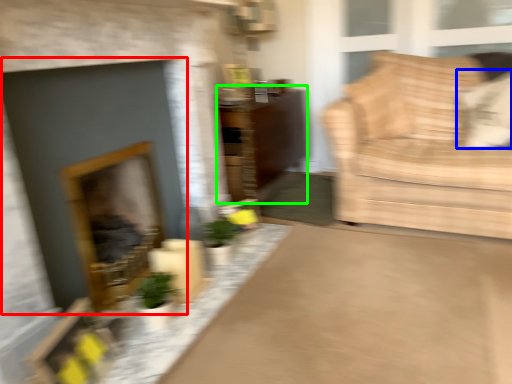
Question: Based on their relative distances, which object is farther from fireplace (highlighted by a red box)? Choose from pillow (highlighted by a blue box) and dresser (highlighted by a green box).

Choices:
 (A) pillow
 (B) dresser

Answer: (A)